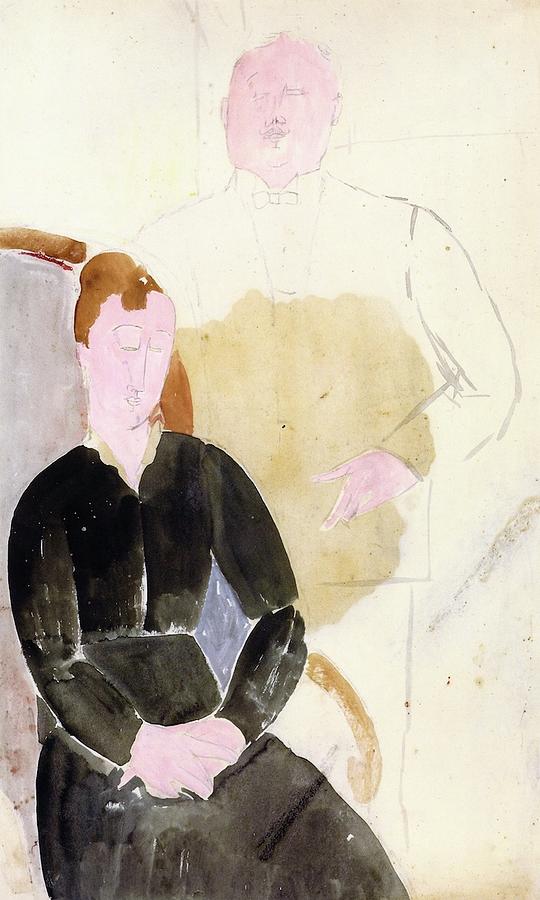
Find the location of a particular element. Image resolution: width=540 pixels, height=900 pixels. chair is located at coordinates (39, 244).